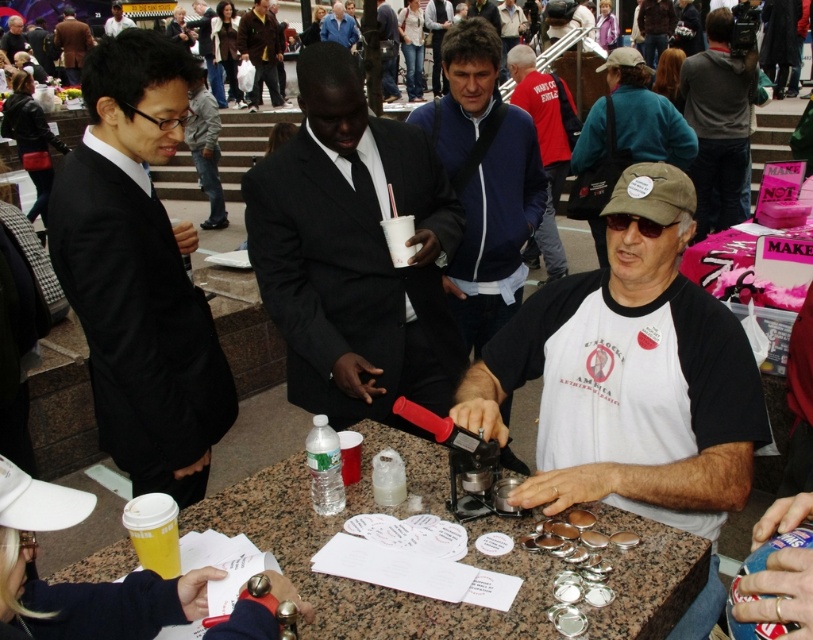
You are at a bustling event and need to locate two attendees wearing a black suit at center and a blue denim jacket at upper center. Based on their positions, which one is positioned to the right side of the other?

The black suit at center is positioned to the right of the blue denim jacket at upper center.

You are standing at the event and want to move from the location of point [455,125] to point [57,45]. Considering the layout described, which direction should you move to reach your destination?

To move from point [455,125] to point [57,45], you should move backward since point [455,125] is in front of point [57,45].

You are standing at the event and want to move from point A to point B. Point A is at coordinates point (285, 180) and point B is at coordinates point (333, 29). Since you need to walk towards point B from point A, will you be moving towards the direction of the staircase or away from it?

Since point (285, 180) is in front of point (333, 29), moving from point A to point B would mean moving away from the staircase direction.